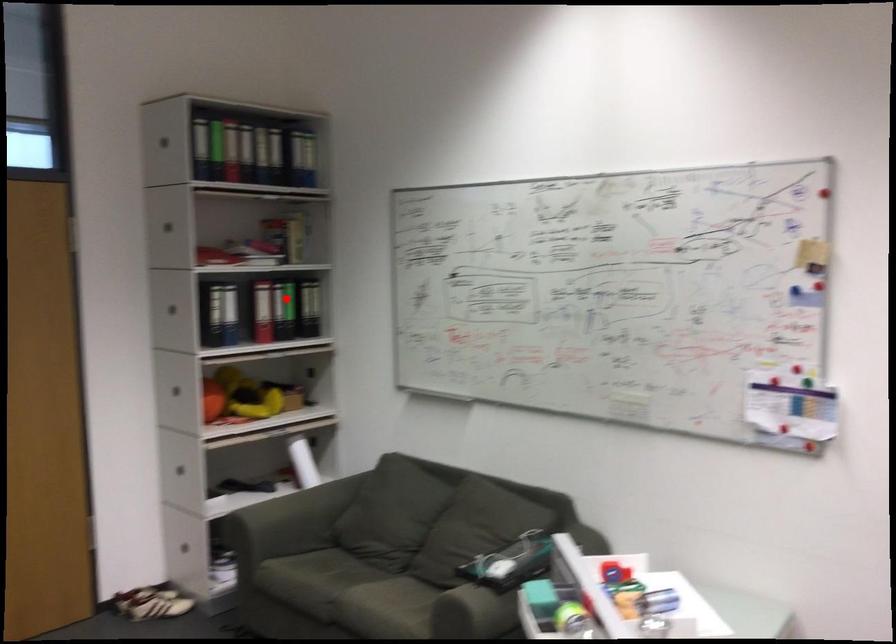
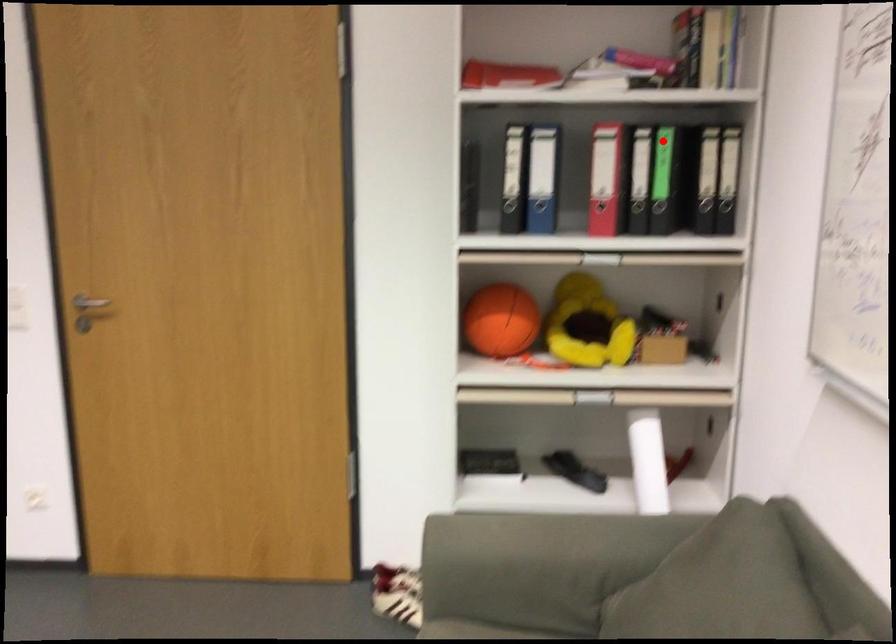
I am providing you with two images of the same scene from different viewpoints. A red point is marked on the first image and another point is marked on the second image. Are the points marked in image1 and image2 representing the same 3D position?

Yes